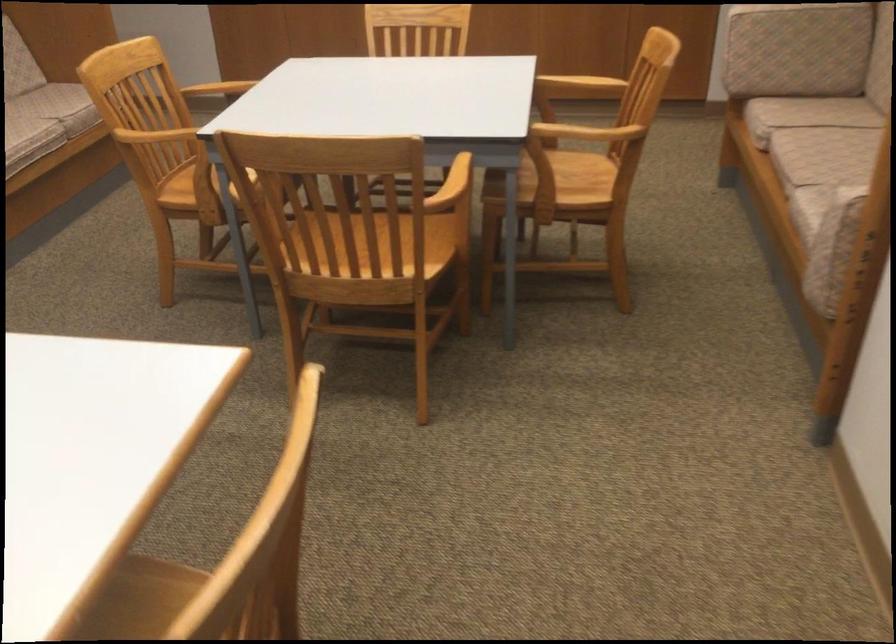
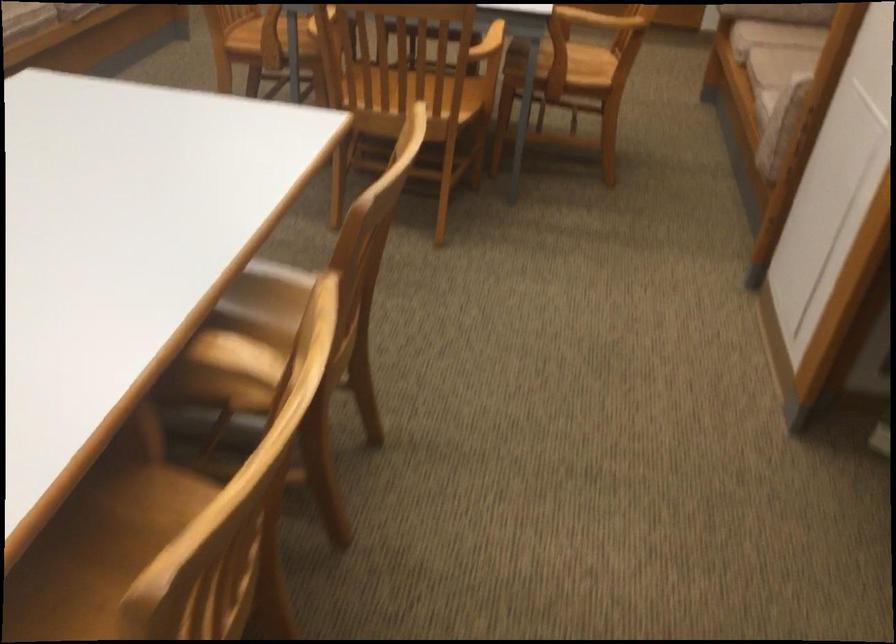
Where in the second image is the point corresponding to pixel 563 189 from the first image?

(570, 69)